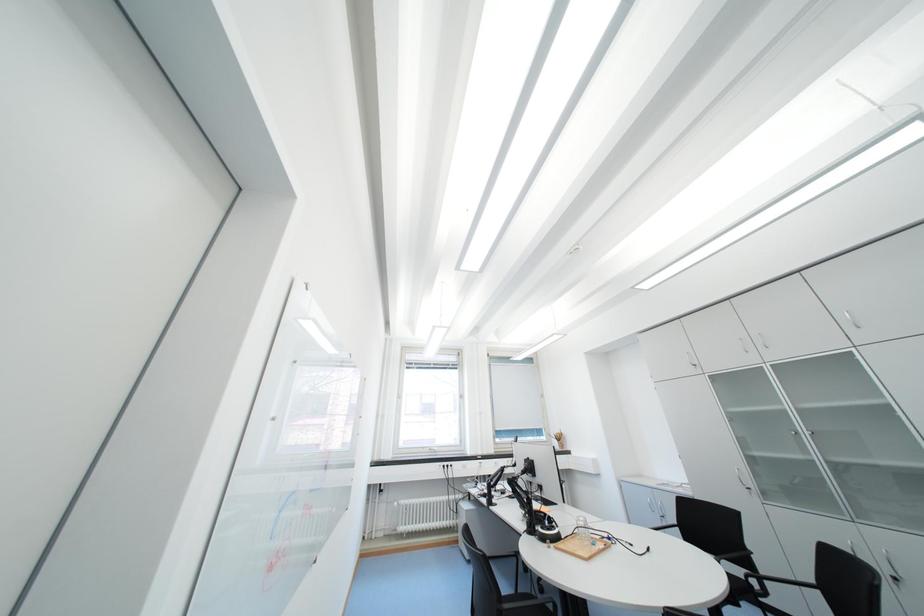
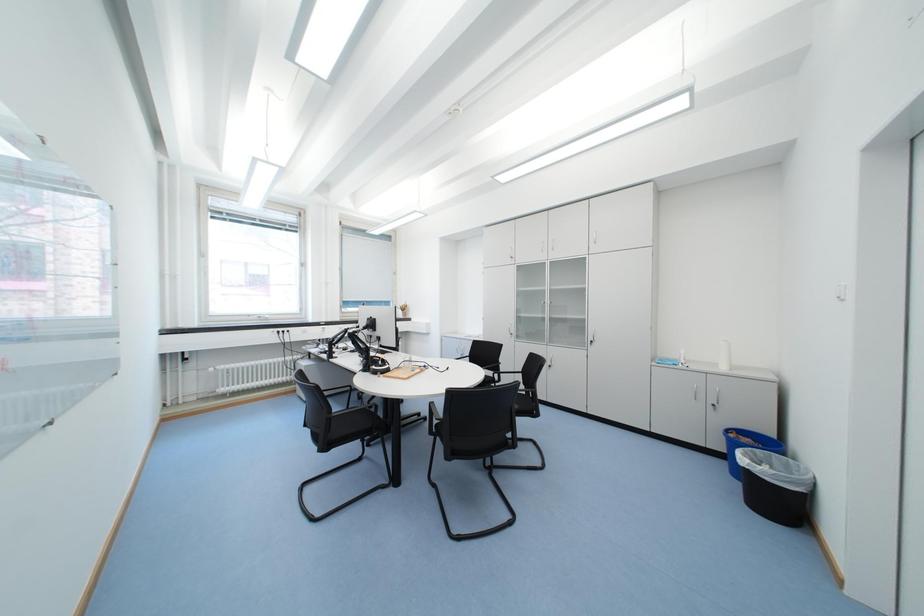
First-person continuous shooting, in which direction is the camera rotating?

The rotation direction of the camera is right-down.